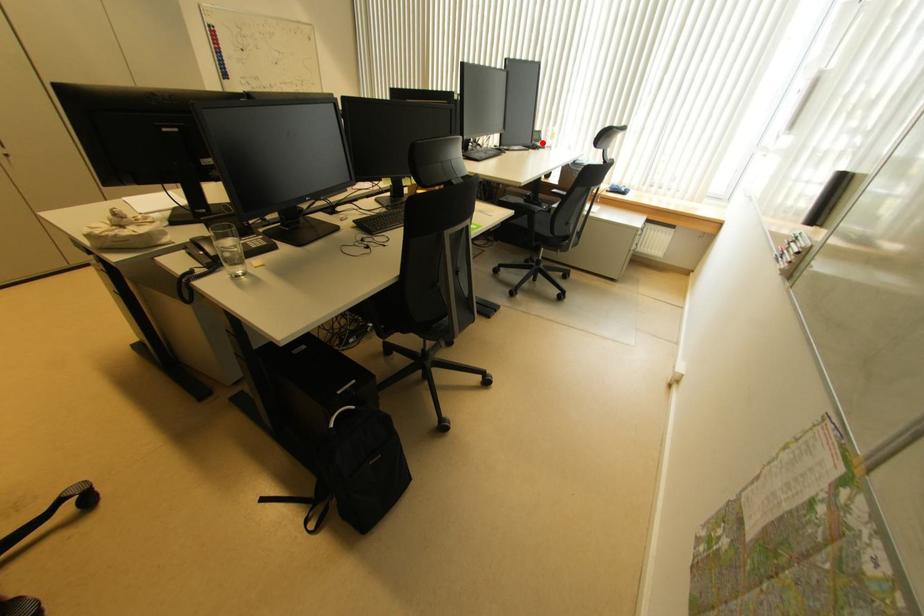
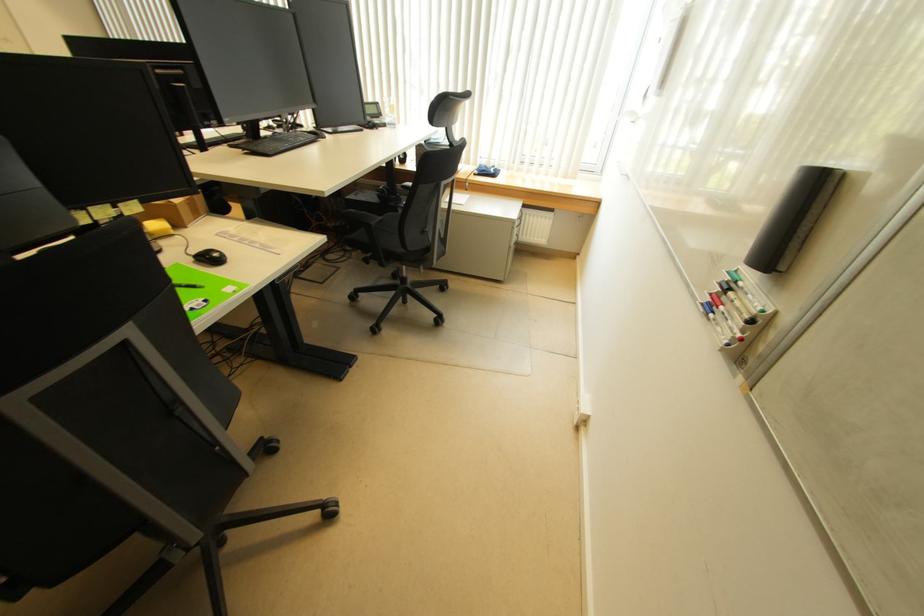
Question: A red point is marked in image1. In image2, is the corresponding 3D point closer to the camera or farther? Reply with the corresponding letter.

Choices:
 (A) The corresponding 3D point is closer.
 (B) The corresponding 3D point is farther.

Answer: (A)